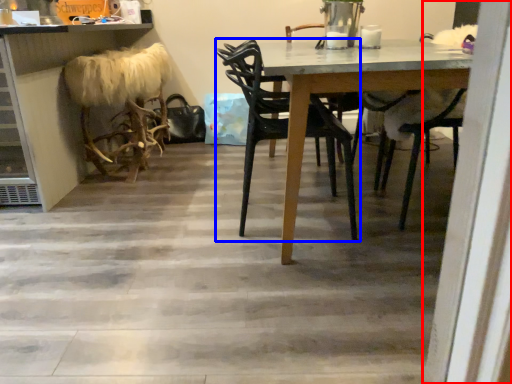
Question: Which object appears closest to the camera in this image, screen door (highlighted by a red box) or chair (highlighted by a blue box)?

Choices:
 (A) screen door
 (B) chair

Answer: (A)